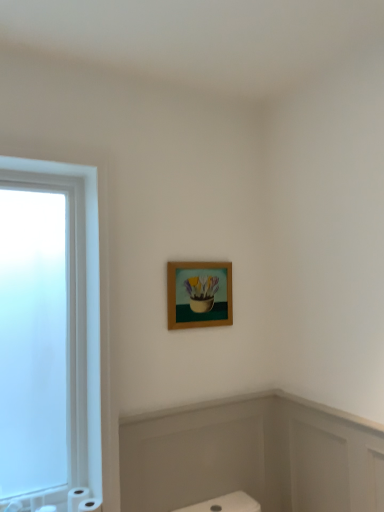
Question: Is white matte toilet paper at lower left, which is counted as the third toilet paper, starting from the left, further to the viewer compared to wooden frame at upper center?

Choices:
 (A) yes
 (B) no

Answer: (B)

Question: Considering the relative sizes of white matte toilet paper at lower left, which is counted as the third toilet paper, starting from the left, and wooden frame at upper center in the image provided, is white matte toilet paper at lower left, which is counted as the third toilet paper, starting from the left, taller than wooden frame at upper center?

Choices:
 (A) no
 (B) yes

Answer: (A)

Question: Is white matte toilet paper at lower left, which is counted as the third toilet paper, starting from the left, far from wooden frame at upper center?

Choices:
 (A) no
 (B) yes

Answer: (A)

Question: From the image's perspective, would you say white matte toilet paper at lower left, which is counted as the third toilet paper, starting from the left, is positioned over wooden frame at upper center?

Choices:
 (A) yes
 (B) no

Answer: (B)

Question: Does white matte toilet paper at lower left, which is counted as the third toilet paper, starting from the left, have a lesser height compared to wooden frame at upper center?

Choices:
 (A) yes
 (B) no

Answer: (A)

Question: Considering the relative sizes of white matte toilet paper at lower left, which is counted as the third toilet paper, starting from the left, and wooden frame at upper center in the image provided, is white matte toilet paper at lower left, which is counted as the third toilet paper, starting from the left, smaller than wooden frame at upper center?

Choices:
 (A) yes
 (B) no

Answer: (A)

Question: Is white matte toilet paper at lower left, the 3th toilet paper viewed from the right, turned away from white matte toilet paper at lower left, placed as the second toilet paper when sorted from right to left?

Choices:
 (A) no
 (B) yes

Answer: (A)

Question: Considering the relative sizes of white matte toilet paper at lower left, which ranks as the 1th toilet paper in left-to-right order, and white matte toilet paper at lower left, the second toilet paper from the left, in the image provided, is white matte toilet paper at lower left, which ranks as the 1th toilet paper in left-to-right order, thinner than white matte toilet paper at lower left, the second toilet paper from the left,?

Choices:
 (A) no
 (B) yes

Answer: (A)

Question: From a real-world perspective, is white matte toilet paper at lower left, which ranks as the 1th toilet paper in left-to-right order, located beneath white matte toilet paper at lower left, the second toilet paper from the left?

Choices:
 (A) no
 (B) yes

Answer: (B)

Question: Is white matte toilet paper at lower left, the 3th toilet paper viewed from the right, behind white matte toilet paper at lower left, placed as the second toilet paper when sorted from right to left?

Choices:
 (A) no
 (B) yes

Answer: (A)

Question: Is white matte toilet paper at lower left, which ranks as the 1th toilet paper in left-to-right order, located outside white matte toilet paper at lower left, the second toilet paper from the left?

Choices:
 (A) no
 (B) yes

Answer: (B)

Question: Is white matte toilet paper at lower left, which ranks as the 1th toilet paper in left-to-right order, closer to the viewer compared to white matte toilet paper at lower left, placed as the second toilet paper when sorted from right to left?

Choices:
 (A) yes
 (B) no

Answer: (A)

Question: Considering the relative sizes of white matte toilet paper at lower left, positioned as the first toilet paper in right-to-left order, and white matte toilet paper at lower left, the second toilet paper from the left, in the image provided, is white matte toilet paper at lower left, positioned as the first toilet paper in right-to-left order, bigger than white matte toilet paper at lower left, the second toilet paper from the left,?

Choices:
 (A) yes
 (B) no

Answer: (B)